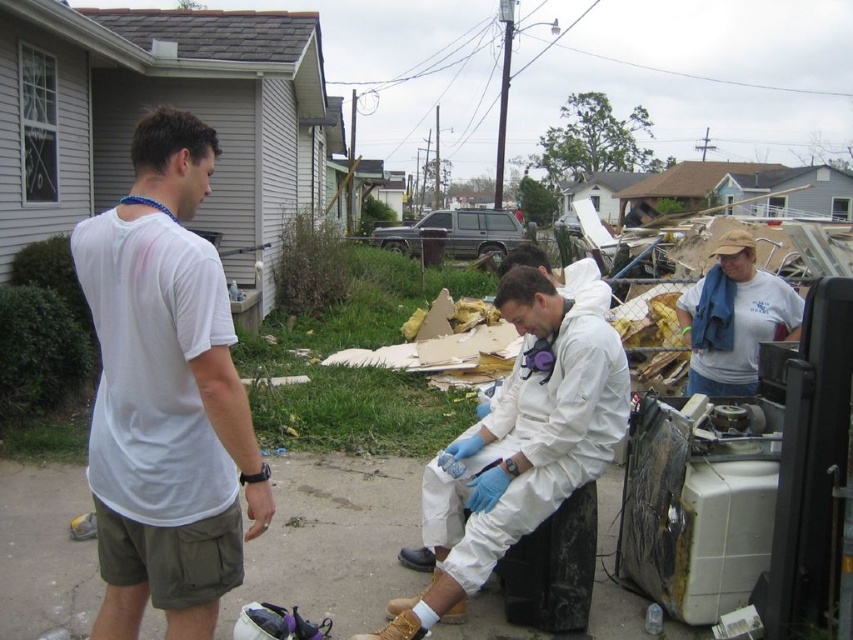
Question: Estimate the real-world distances between objects in this image. Which object is closer to the white t-shirt at right?

Choices:
 (A) white cotton t-shirt at left
 (B) white matte hazmat suit at center

Answer: (B)

Question: Is white cotton t-shirt at left positioned at the back of white matte hazmat suit at center?

Choices:
 (A) no
 (B) yes

Answer: (A)

Question: Which of the following is the farthest from the observer?

Choices:
 (A) (752, 356)
 (B) (467, 552)
 (C) (193, 236)

Answer: (A)

Question: Observing the image, what is the correct spatial positioning of white cotton t-shirt at left in reference to white matte hazmat suit at center?

Choices:
 (A) right
 (B) left

Answer: (B)

Question: Is white cotton t-shirt at left further to the viewer compared to white t-shirt at right?

Choices:
 (A) no
 (B) yes

Answer: (A)

Question: Estimate the real-world distances between objects in this image. Which object is closer to the white t-shirt at right?

Choices:
 (A) white cotton t-shirt at left
 (B) white matte hazmat suit at center

Answer: (B)